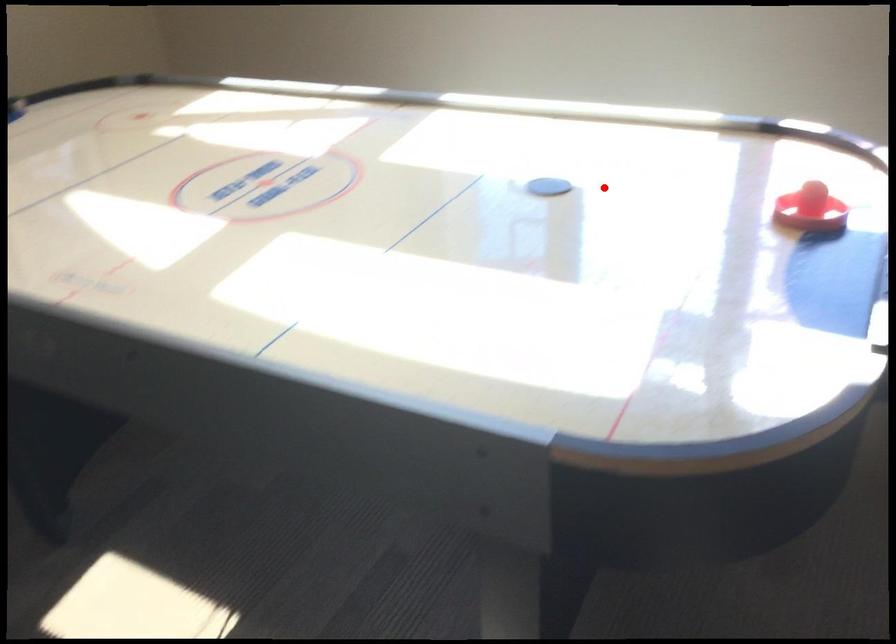
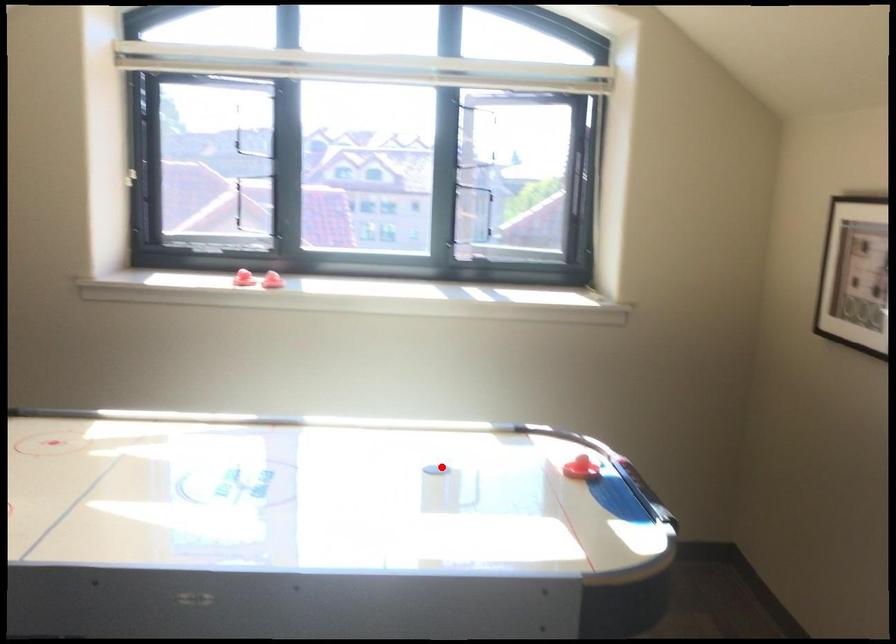
I am providing you with two images of the same scene from different viewpoints. A red point is marked on the first image and another point is marked on the second image. Is the red point in image1 aligned with the point shown in image2?

Yes